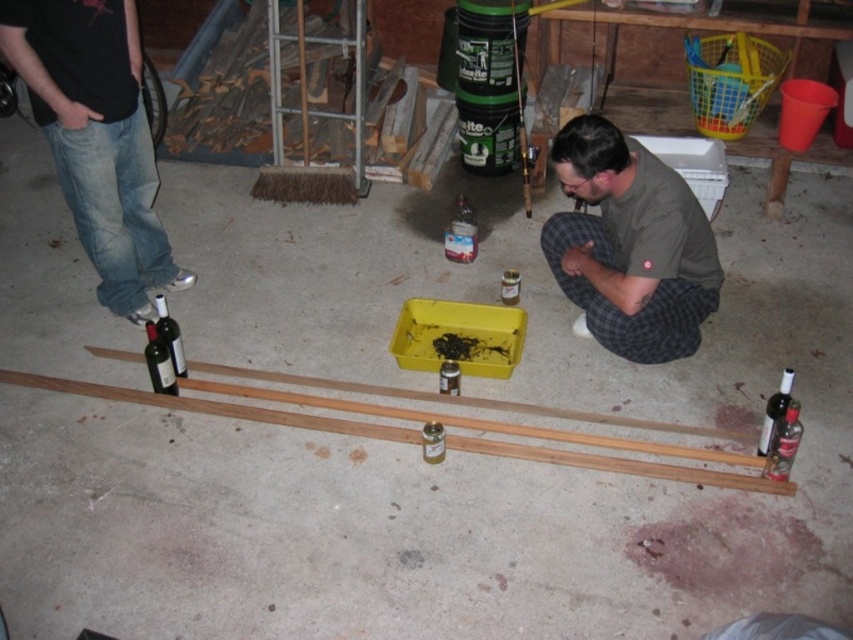
Question: Which point is farther to the camera?

Choices:
 (A) (763, 417)
 (B) (590, 305)

Answer: (A)

Question: Where is matte black wine bottle at lower left located in relation to matte glass wine bottle at lower left in the image?

Choices:
 (A) right
 (B) left

Answer: (B)

Question: Which object is positioned closest to the matte glass wine bottle at lower left?

Choices:
 (A) jeans at left
 (B) matte black wine bottle at lower left
 (C) green cotton shirt at lower center
 (D) matte black wine bottle at lower right

Answer: (B)

Question: Is jeans at left thinner than matte glass wine bottle at lower left?

Choices:
 (A) no
 (B) yes

Answer: (A)

Question: Estimate the real-world distances between objects in this image. Which object is farther from the translucent glass bottle at lower right?

Choices:
 (A) jeans at left
 (B) matte black wine bottle at lower left

Answer: (A)

Question: Does jeans at left come behind green cotton shirt at lower center?

Choices:
 (A) yes
 (B) no

Answer: (A)